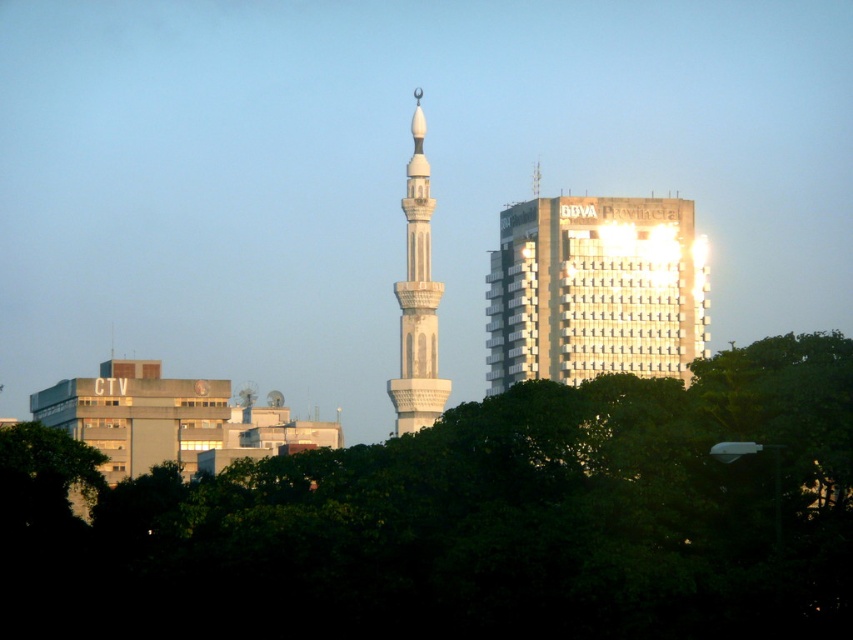
Question: Which point is farther from the camera taking this photo?

Choices:
 (A) (408, 227)
 (B) (515, 300)
 (C) (430, 566)

Answer: (A)

Question: Which point appears farthest from the camera in this image?

Choices:
 (A) (422, 323)
 (B) (514, 314)
 (C) (807, 387)

Answer: (C)

Question: Is green leafy tree at lower center smaller than white marble minaret at center?

Choices:
 (A) yes
 (B) no

Answer: (B)

Question: Which object is positioned closest to the green leafy tree at lower center?

Choices:
 (A) white glass building at upper center
 (B) white marble minaret at center

Answer: (A)

Question: Is green leafy tree at lower center positioned in front of white glass building at upper center?

Choices:
 (A) yes
 (B) no

Answer: (A)

Question: Considering the relative positions of green leafy tree at lower center and white glass building at upper center in the image provided, where is green leafy tree at lower center located with respect to white glass building at upper center?

Choices:
 (A) above
 (B) below

Answer: (B)